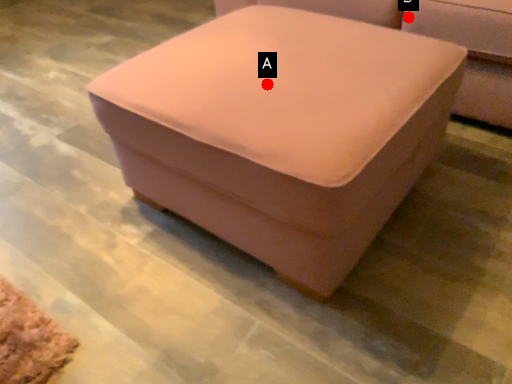
Question: Two points are circled on the image, labeled by A and B beside each circle. Which point is farther to the camera?

Choices:
 (A) A is further
 (B) B is further

Answer: (B)